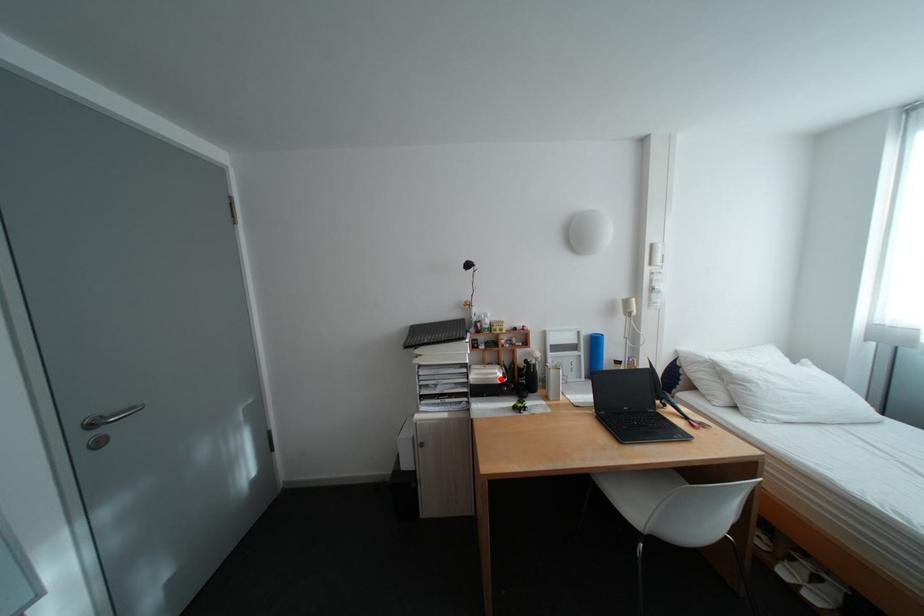
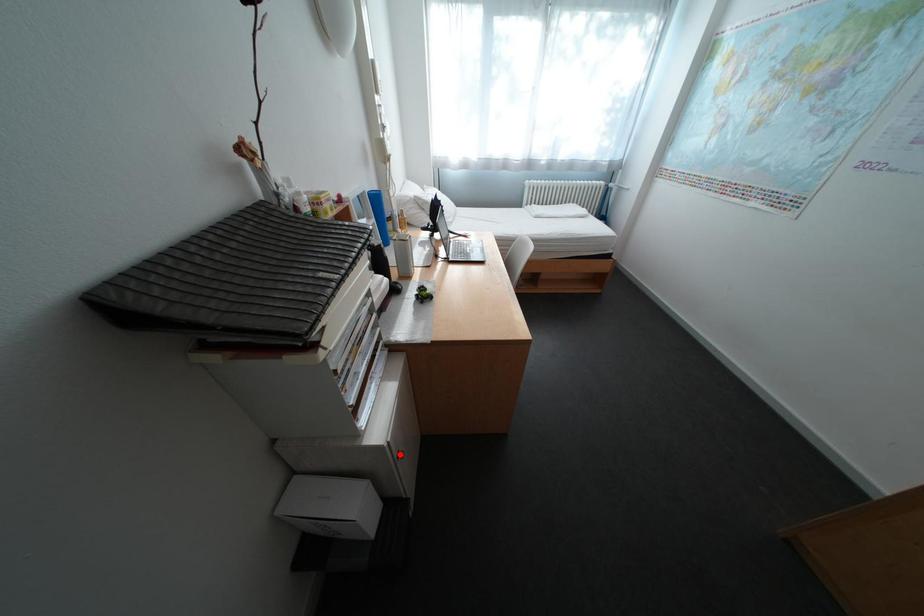
I am providing you with two images of the same scene from different viewpoints. A red point is marked on the first image and another point is marked on the second image. Is the marked point in image1 the same physical position as the marked point in image2?

No